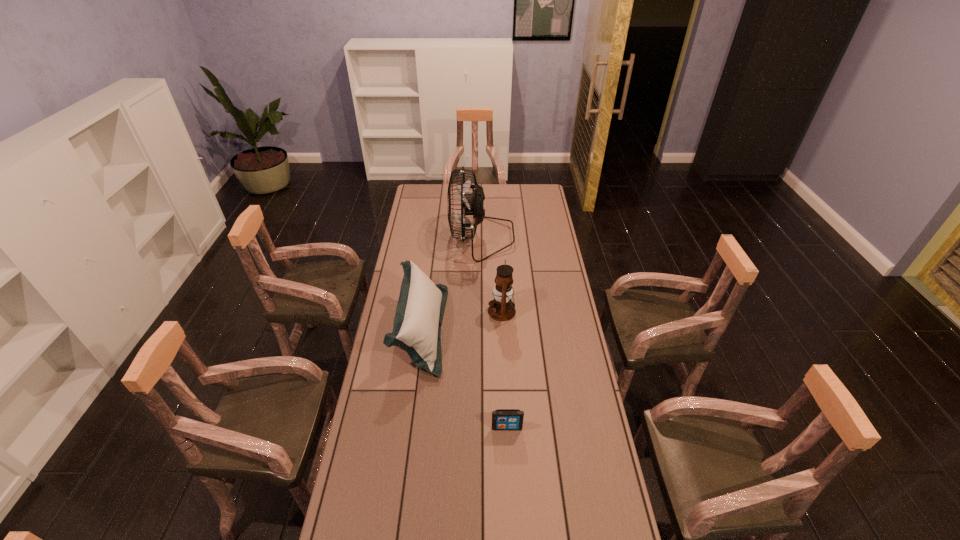
Identify the location of vacant space located on the side of the lantern, there is a wick adjustment knob. The image size is (960, 540). (405, 311).

Find the location of `free space located 0.230m on the side of the lantern, there is a wick adjustment knob`. free space located 0.230m on the side of the lantern, there is a wick adjustment knob is located at coordinates (435, 311).

Identify the location of free space located on the surface of the cushion. The height and width of the screenshot is (540, 960). 462,329.

In order to click on vacant space located on the front screen of the nearest object in this screenshot , I will do `click(513, 533)`.

At what (x,y) coordinates should I click in order to perform the action: click on object located at the left edge. Please return your answer as a coordinate pair (x, y). This screenshot has width=960, height=540. Looking at the image, I should click on (420, 309).

Where is `vacant region at the left edge of the desktop`? vacant region at the left edge of the desktop is located at coordinates (369, 490).

Locate an element on the screen. blank area at the right edge is located at coordinates (534, 220).

Identify the location of vacant point at the far left corner. Image resolution: width=960 pixels, height=540 pixels. click(x=420, y=198).

Locate an element on the screen. vacant space that is in between the shortest object and the lantern is located at coordinates (504, 369).

This screenshot has height=540, width=960. I want to click on free space between the iPod and the cushion, so click(464, 379).